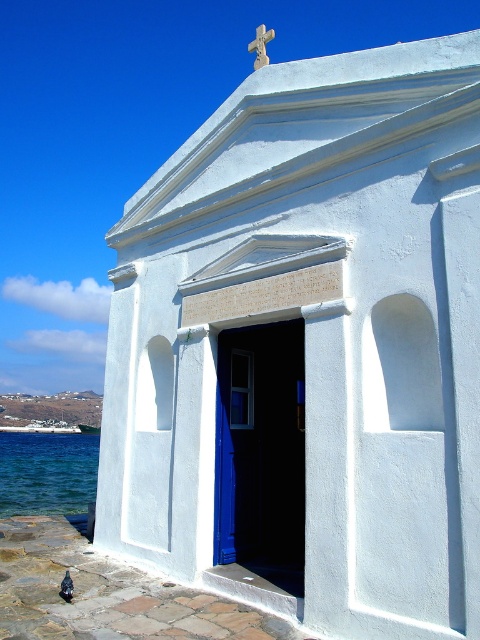
Question: Which object is closer to the camera taking this photo?

Choices:
 (A) blue liquid water at lower left
 (B) stone textured cross at upper center

Answer: (B)

Question: Which object appears farthest from the camera in this image?

Choices:
 (A) stone textured cross at upper center
 (B) black feathered pigeon at lower left

Answer: (A)

Question: Which point is farther from the camera taking this photo?

Choices:
 (A) (252, 65)
 (B) (71, 586)

Answer: (A)

Question: Is blue liquid water at lower left positioned at the back of black feathered pigeon at lower left?

Choices:
 (A) yes
 (B) no

Answer: (A)

Question: Is blue liquid water at lower left wider than black feathered pigeon at lower left?

Choices:
 (A) yes
 (B) no

Answer: (A)

Question: Is blue liquid water at lower left to the right of stone textured cross at upper center from the viewer's perspective?

Choices:
 (A) yes
 (B) no

Answer: (B)